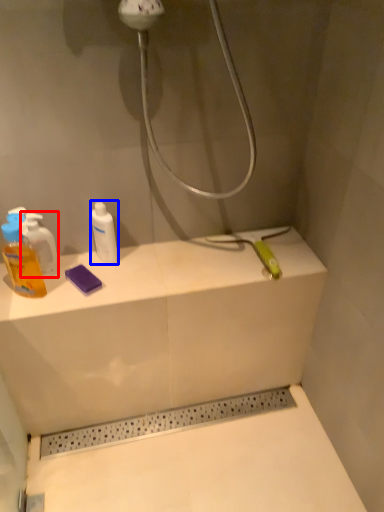
Question: Which point is further to the camera, mouthwash (highlighted by a red box) or mouthwash (highlighted by a blue box)?

Choices:
 (A) mouthwash
 (B) mouthwash

Answer: (B)